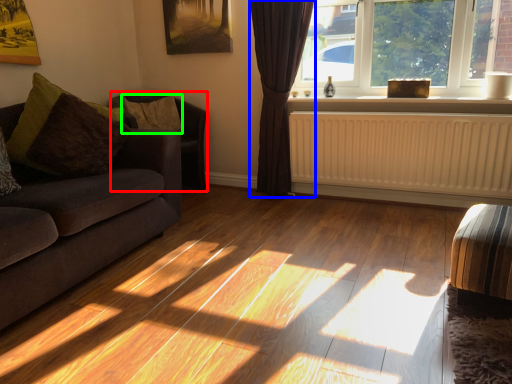
Question: Which object is positioned farthest from armchair (highlighted by a red box)? Select from curtain (highlighted by a blue box) and pillow (highlighted by a green box).

Choices:
 (A) curtain
 (B) pillow

Answer: (A)